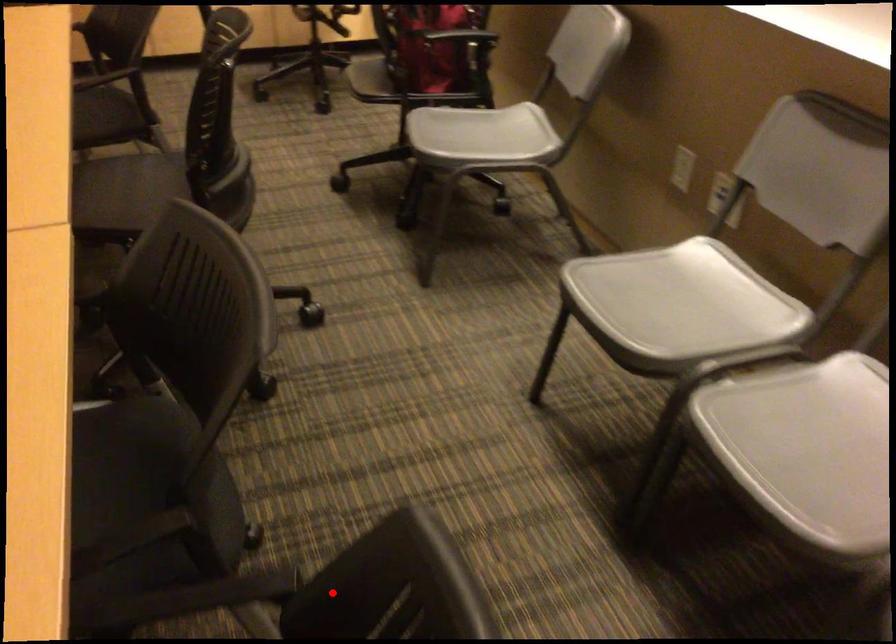
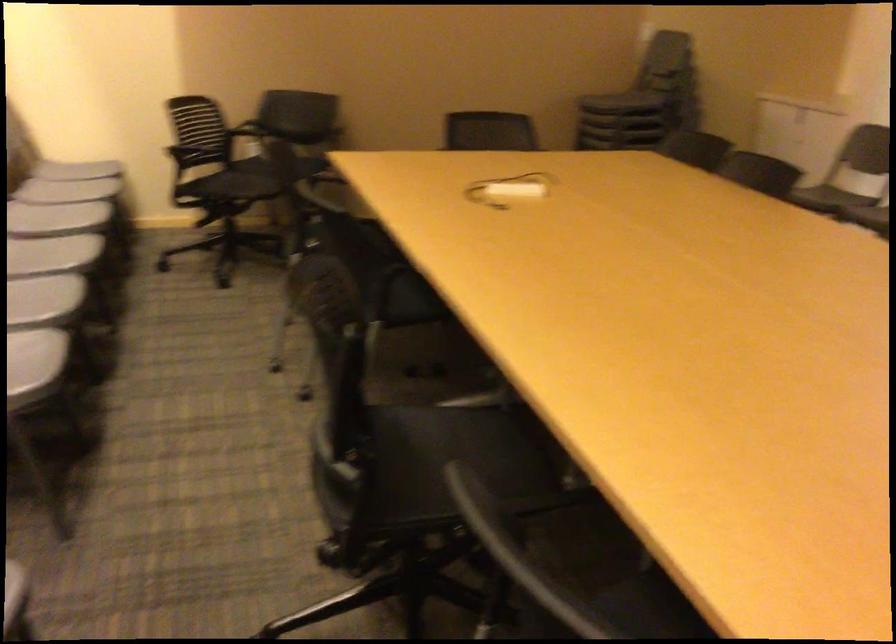
Question: I am providing you with two images of the same scene from different viewpoints. A red point is marked on the first image. At the location where the point appears in image 1, is it still visible in image 2?

Choices:
 (A) Yes
 (B) No

Answer: (B)